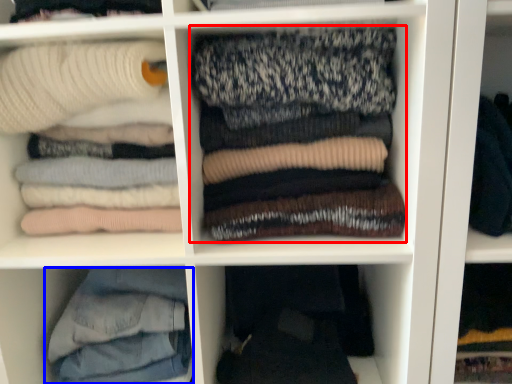
Question: Among these objects, which one is farthest to the camera, laundry (highlighted by a red box) or trousers (highlighted by a blue box)?

Choices:
 (A) laundry
 (B) trousers

Answer: (B)